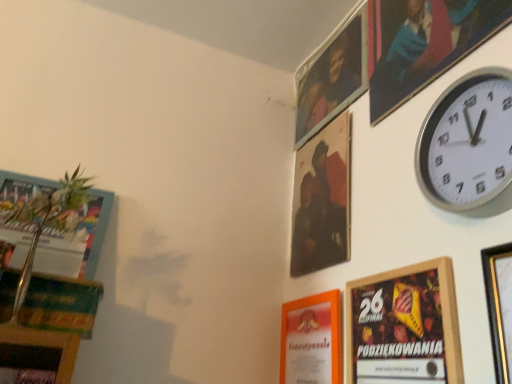
Question: Is wooden picture frame at upper right, the fourth picture frame positioned from the back, taller or shorter than orange paper at lower center, the 4th picture frame from the front?

Choices:
 (A) short
 (B) tall

Answer: (A)

Question: Is wooden picture frame at upper right, the fourth picture frame positioned from the back, wider or thinner than orange paper at lower center, the 4th picture frame from the front?

Choices:
 (A) thin
 (B) wide

Answer: (A)

Question: Estimate the real-world distances between objects in this image. Which object is closer to the silver metallic wall clock at upper right?

Choices:
 (A) metallic silver picture frame at upper right, which is the first picture frame from back to front
 (B) wooden framed poster at lower right, which appears as the 5th picture frame when viewed from the back
 (C) orange paper at lower center, the 4th picture frame from the front
 (D) wooden picture frame at upper right, which appears as the 3th picture frame when viewed from the front
 (E) matte black portrait at upper center, which is counted as the fifth picture frame, starting from the front

Answer: (D)

Question: Based on their relative distances, which object is nearer to the wooden picture frame at upper right, which appears as the 3th picture frame when viewed from the front?

Choices:
 (A) silver metallic wall clock at upper right
 (B) gold metallic picture frame at upper right, which is the 6th picture frame from back to front
 (C) orange paper at lower center, placed as the 3th picture frame when sorted from back to front
 (D) wooden framed poster at lower right, which appears as the 5th picture frame when viewed from the back
 (E) matte black portrait at upper center, which is counted as the fifth picture frame, starting from the front

Answer: (A)